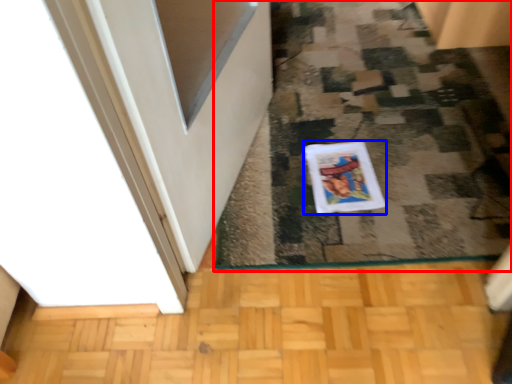
Question: Among these objects, which one is nearest to the camera, doormat (highlighted by a red box) or comic book (highlighted by a blue box)?

Choices:
 (A) doormat
 (B) comic book

Answer: (A)